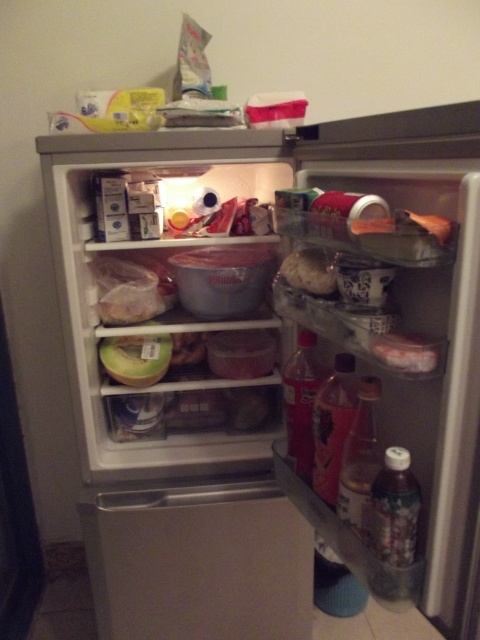
Question: Which of the following is the closest to the observer?

Choices:
 (A) (118, 356)
 (B) (379, 525)
 (C) (310, 403)

Answer: (B)

Question: Which of these objects is positioned farthest from the matte plastic bag at center?

Choices:
 (A) green plastic container at center
 (B) translucent plastic container at center
 (C) translucent plastic bottle at center
 (D) translucent plastic bottle at lower right

Answer: (A)

Question: Which of the following is the farthest from the observer?

Choices:
 (A) translucent plastic bottle at lower right
 (B) green plastic container at center
 (C) translucent plastic container at center
 (D) matte plastic bag at center

Answer: (B)

Question: Does translucent plastic container at center come in front of matte plastic bag at center?

Choices:
 (A) no
 (B) yes

Answer: (B)

Question: Is translucent plastic bottle at center wider than matte plastic bag at center?

Choices:
 (A) no
 (B) yes

Answer: (A)

Question: Can you confirm if translucent plastic soda at center is thinner than translucent plastic bottle at center?

Choices:
 (A) yes
 (B) no

Answer: (A)